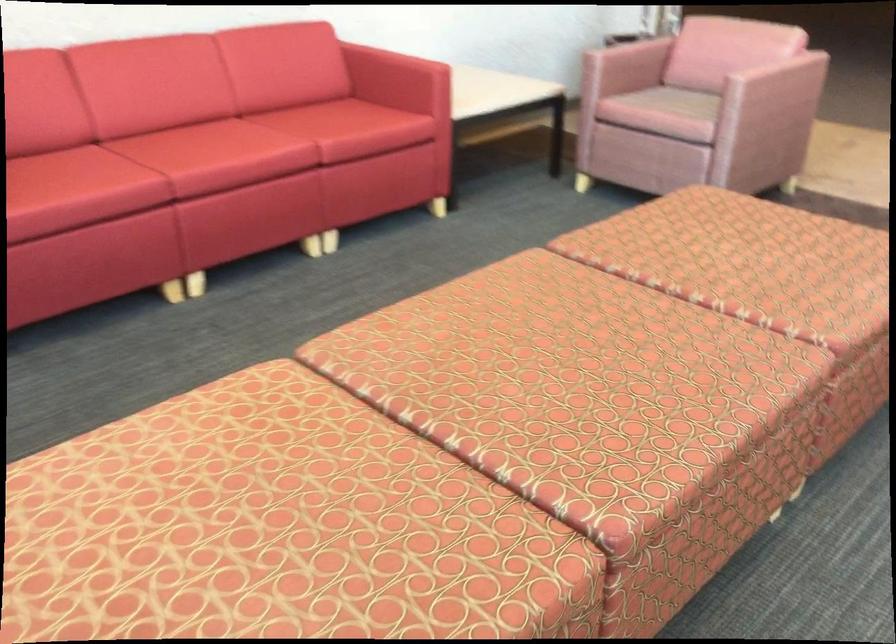
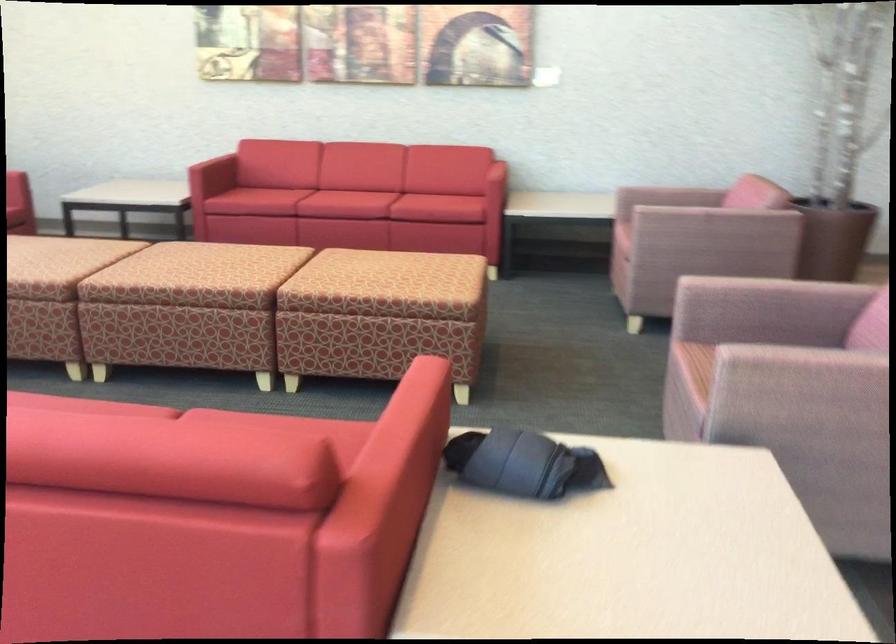
Where in the second image is the point corresponding to [782,269] from the first image?

(385, 270)